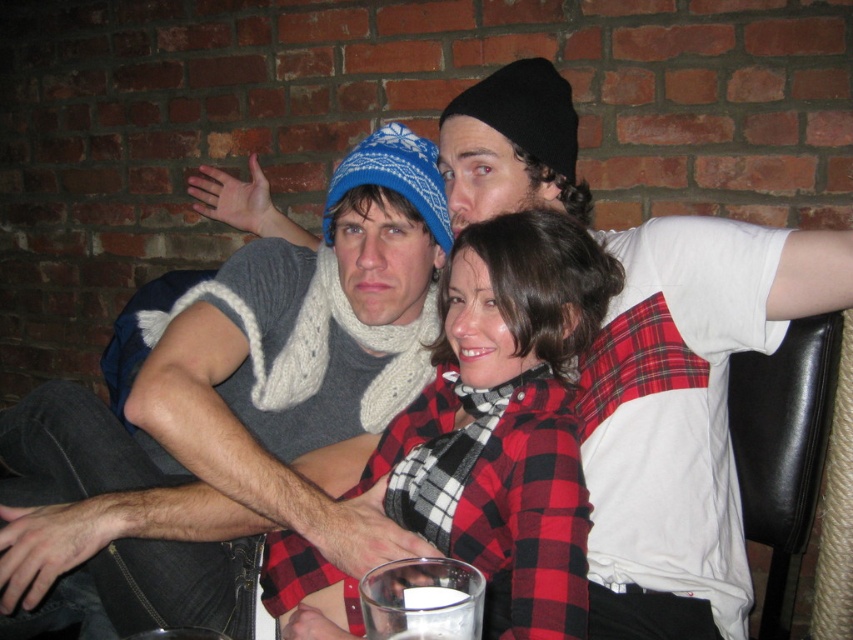
Does knitted wool scarf at upper center have a greater height compared to red plaid shirt at center?

Yes.

Which is above, knitted wool scarf at upper center or red plaid shirt at center?

Positioned higher is knitted wool scarf at upper center.

Between point (495, 74) and point (479, 337), which one is positioned in front?

Point (479, 337) is in front.

This screenshot has width=853, height=640. I want to click on knitted wool scarf at upper center, so click(686, 413).

Does knitted wool hat at upper center have a smaller size compared to red plaid shirt at center?

No.

Measure the distance between knitted wool hat at upper center and camera.

The distance of knitted wool hat at upper center from camera is 35.98 inches.

Does point (45, 536) come farther from viewer compared to point (564, 557)?

Yes, it is behind point (564, 557).

What are the coordinates of `knitted wool hat at upper center` in the screenshot? It's located at (236, 417).

Which is in front, point (134, 593) or point (672, 538)?

Point (672, 538)

Who is lower down, knitted wool hat at upper center or knitted wool scarf at upper center?

Positioned lower is knitted wool hat at upper center.

Is point (213, 566) positioned after point (677, 432)?

Yes, point (213, 566) is behind point (677, 432).

Where is `knitted wool hat at upper center`? knitted wool hat at upper center is located at coordinates point(236,417).